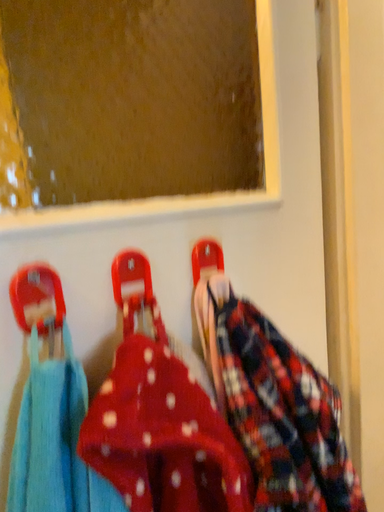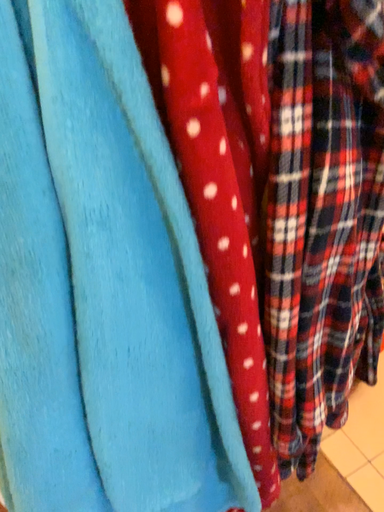
Question: How did the camera likely rotate when shooting the video?

Choices:
 (A) rotated upward
 (B) rotated downward

Answer: (B)